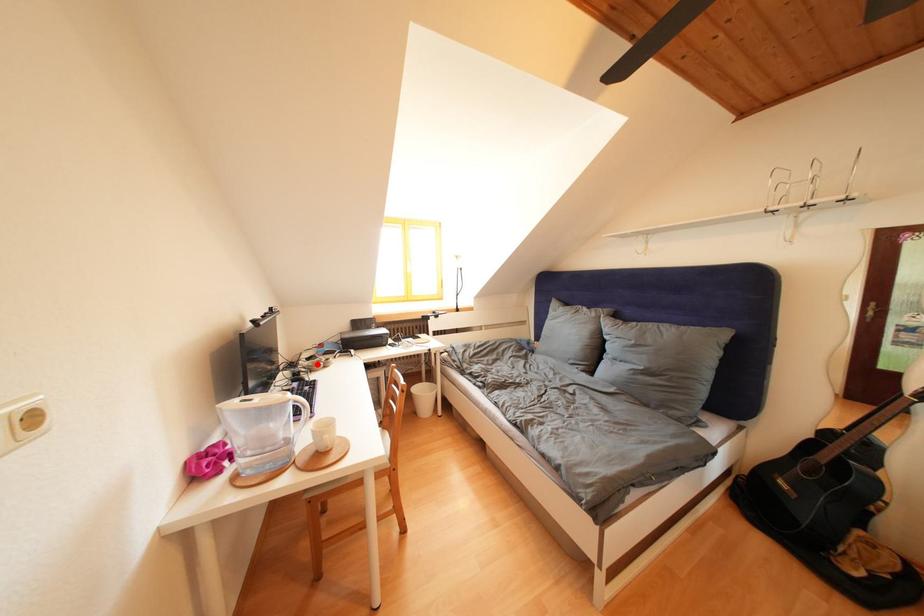
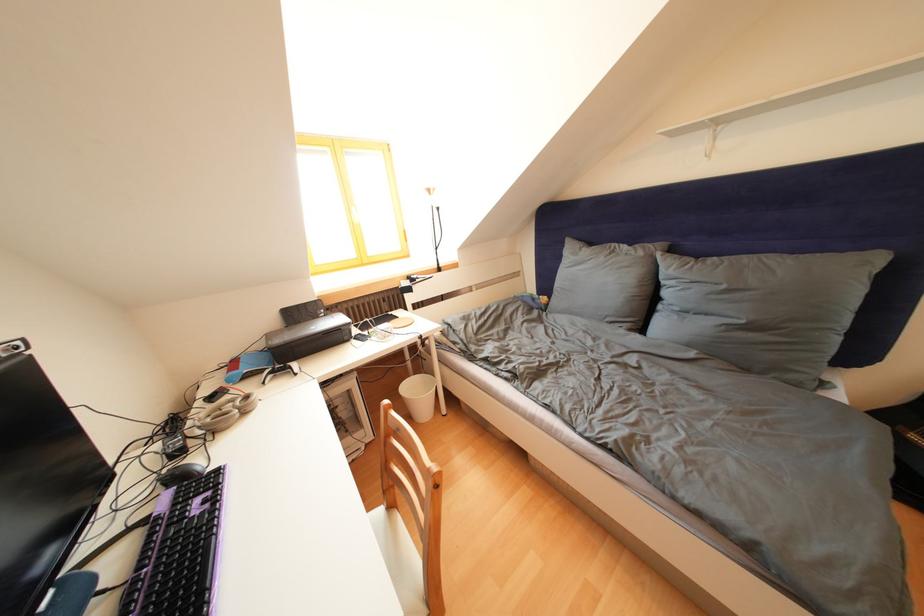
Locate, in the second image, the point that corresponds to the highlighted location in the first image.

(220, 403)